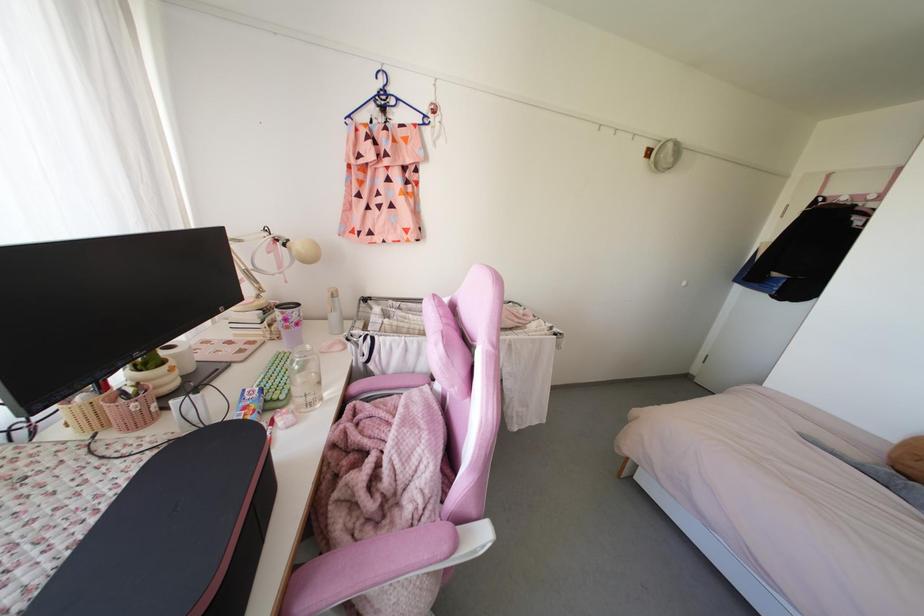
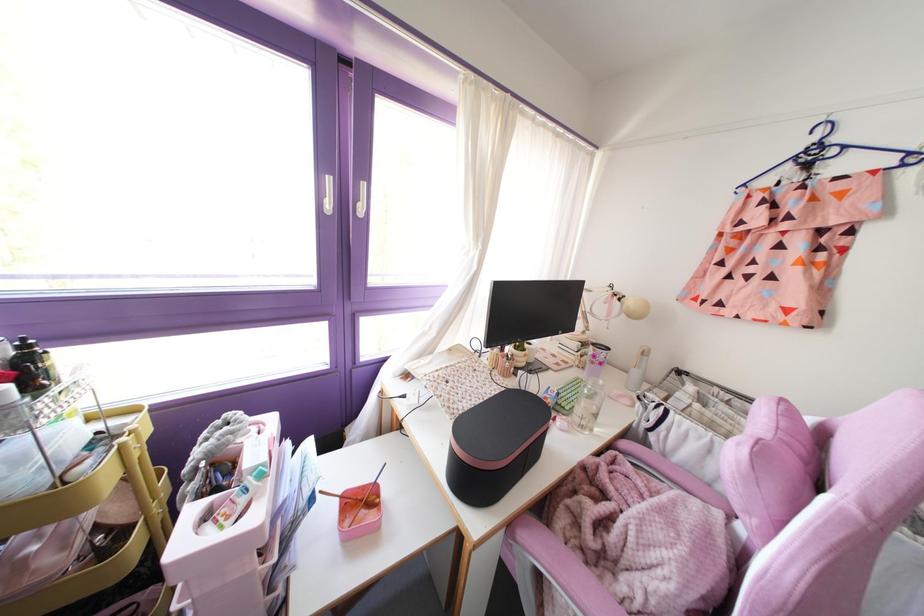
Where in the second image is the point corresponding to point 426,121 from the first image?

(913, 159)